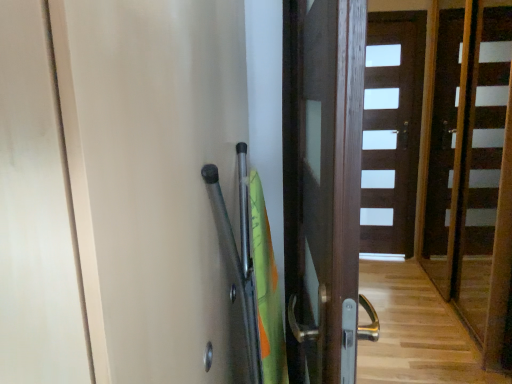
Question: Is dark wood door at center, arranged as the first door when viewed from the left, oriented away from brown wooden door at center, which is the first door in right-to-left order?

Choices:
 (A) yes
 (B) no

Answer: (B)

Question: Does dark wood door at center, arranged as the first door when viewed from the left, have a smaller size compared to brown wooden door at center, the 1th door in the back-to-front sequence?

Choices:
 (A) no
 (B) yes

Answer: (A)

Question: Can we say dark wood door at center, arranged as the 2th door when viewed from the right, lies outside brown wooden door at center, the 2th door positioned from the front?

Choices:
 (A) no
 (B) yes

Answer: (B)

Question: From a real-world perspective, is dark wood door at center, arranged as the first door when viewed from the front, physically below brown wooden door at center, the 2th door positioned from the front?

Choices:
 (A) no
 (B) yes

Answer: (A)

Question: Can you confirm if dark wood door at center, arranged as the 2th door when viewed from the right, is positioned to the left of brown wooden door at center, which is the first door in right-to-left order?

Choices:
 (A) yes
 (B) no

Answer: (A)

Question: Visually, is brown wooden door at center, which is the first door in right-to-left order, positioned to the left or to the right of dark wood door at center, arranged as the first door when viewed from the left?

Choices:
 (A) left
 (B) right

Answer: (B)

Question: In the image, is brown wooden door at center, which is the first door in right-to-left order, positioned in front of or behind dark wood door at center, arranged as the first door when viewed from the left?

Choices:
 (A) behind
 (B) front

Answer: (A)

Question: In terms of height, does brown wooden door at center, the 2th door positioned from the front, look taller or shorter compared to dark wood door at center, arranged as the 2th door when viewed from the right?

Choices:
 (A) short
 (B) tall

Answer: (B)

Question: Considering the positions of brown wooden door at center, the 2th door positioned from the front, and dark wood door at center, arranged as the first door when viewed from the front, in the image, is brown wooden door at center, the 2th door positioned from the front, wider or thinner than dark wood door at center, arranged as the first door when viewed from the front,?

Choices:
 (A) wide
 (B) thin

Answer: (B)

Question: From a real-world perspective, is dark wood door at center, arranged as the first door when viewed from the front, above or below wooden stairs at center?

Choices:
 (A) above
 (B) below

Answer: (A)

Question: Considering the positions of dark wood door at center, arranged as the 2th door when viewed from the right, and wooden stairs at center in the image, is dark wood door at center, arranged as the 2th door when viewed from the right, bigger or smaller than wooden stairs at center?

Choices:
 (A) big
 (B) small

Answer: (B)

Question: Would you say dark wood door at center, arranged as the first door when viewed from the front, is inside or outside wooden stairs at center?

Choices:
 (A) outside
 (B) inside

Answer: (A)

Question: Looking at their shapes, would you say dark wood door at center, arranged as the 2th door when viewed from the right, is wider or thinner than wooden stairs at center?

Choices:
 (A) wide
 (B) thin

Answer: (A)

Question: In terms of height, does transparent plastic screen door at upper right look taller or shorter compared to brown wooden door at center, the 2th door positioned from the front?

Choices:
 (A) short
 (B) tall

Answer: (A)

Question: From a real-world perspective, is transparent plastic screen door at upper right physically located above or below brown wooden door at center, the 2th door positioned from the front?

Choices:
 (A) above
 (B) below

Answer: (A)